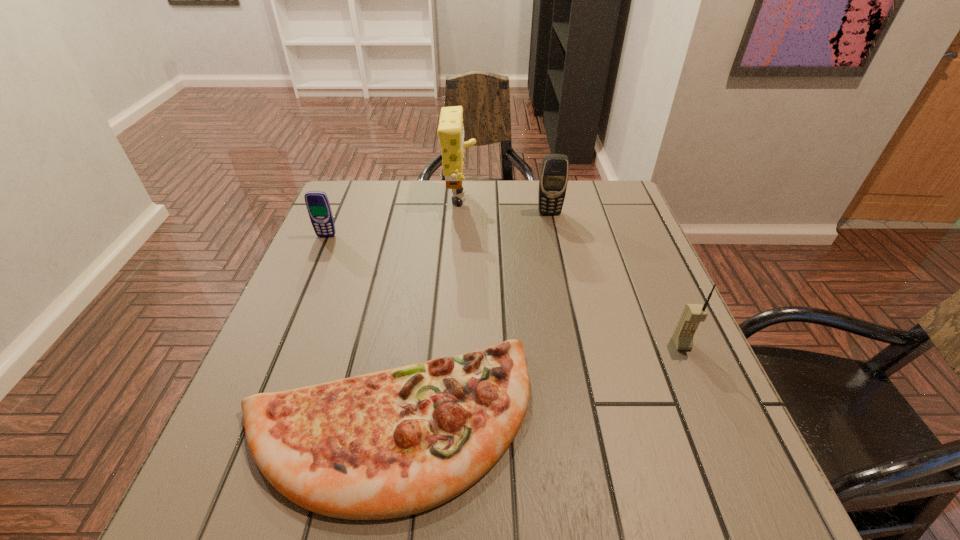
You are a GUI agent. You are given a task and a screenshot of the screen. Output one action in this format:
    pyautogui.click(x=<x>, y=<y>)
    Task: Click on the vacant space located 0.060m on the front face of the farthest cellular telephone
    This screenshot has width=960, height=540.
    Given the screenshot: What is the action you would take?
    pyautogui.click(x=553, y=229)

You are a GUI agent. You are given a task and a screenshot of the screen. Output one action in this format:
    pyautogui.click(x=<x>, y=<y>)
    Task: Click on the vacant area situated 0.300m on the front of the rightmost cellular telephone, where the keypad is located
    The width and height of the screenshot is (960, 540).
    Given the screenshot: What is the action you would take?
    pyautogui.click(x=754, y=510)

Where is `vacant space located on the front-facing side of the third nearest object`? vacant space located on the front-facing side of the third nearest object is located at coordinates (281, 341).

What are the coordinates of `free space located on the right of the pizza` in the screenshot? It's located at (648, 423).

This screenshot has height=540, width=960. What are the coordinates of `sponge that is positioned at the far edge` in the screenshot? It's located at (450, 131).

Identify the location of cellular telephone that is positioned at the far edge. (553, 179).

Image resolution: width=960 pixels, height=540 pixels. Find the location of `object at the near edge`. object at the near edge is located at coordinates (394, 443).

Identify the location of cellular telephone that is positioned at the left edge. Image resolution: width=960 pixels, height=540 pixels. (317, 203).

Locate an element on the screen. This screenshot has width=960, height=540. pizza at the left edge is located at coordinates (394, 443).

You are a GUI agent. You are given a task and a screenshot of the screen. Output one action in this format:
    pyautogui.click(x=<x>, y=<y>)
    Task: Click on the object that is at the right edge
    The width and height of the screenshot is (960, 540).
    Given the screenshot: What is the action you would take?
    pyautogui.click(x=693, y=314)